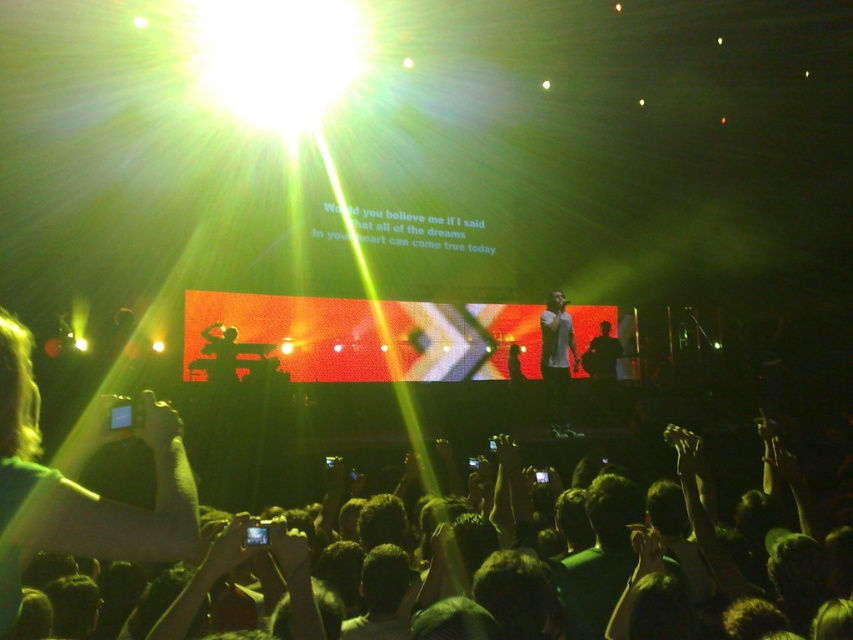
Consider the image. Can you confirm if white matte shirt at center is positioned below silhouette figure at center?

Yes.

Between point (547, 323) and point (608, 348), which one is positioned behind?

The point (608, 348) is more distant.

Is point (554, 305) farther from viewer compared to point (590, 369)?

That is False.

The image size is (853, 640). Identify the location of white matte shirt at center. (556, 362).